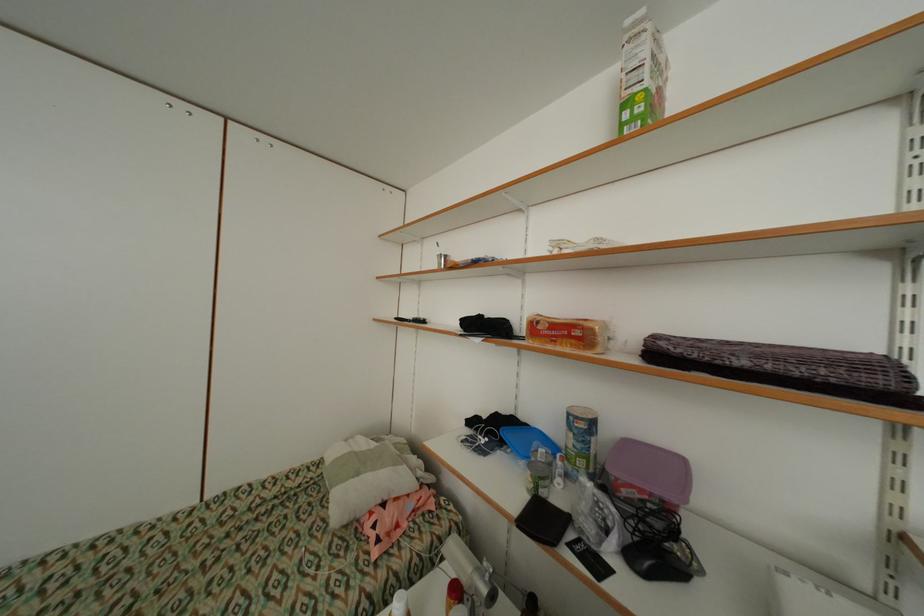
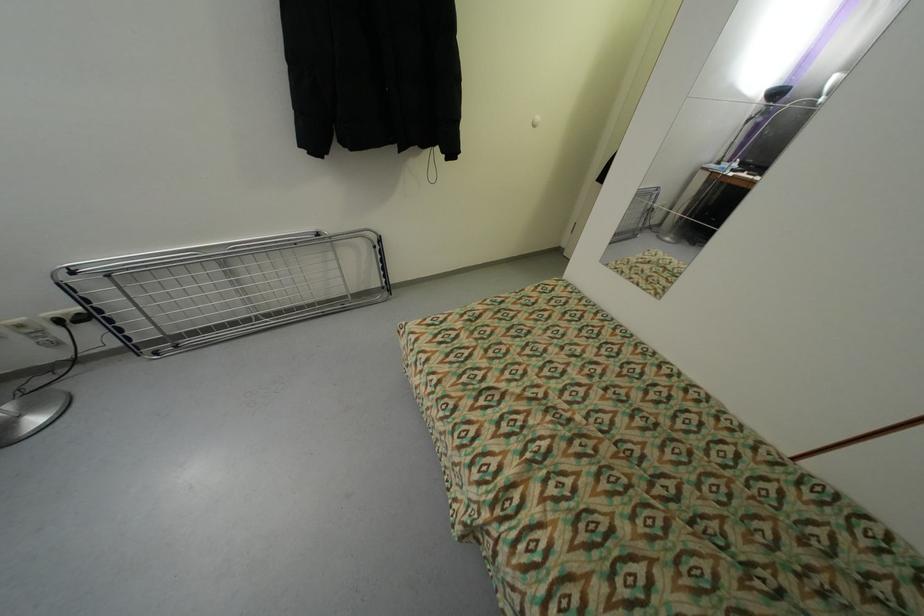
Based on the continuous images, in which direction is the camera rotating?

The rotation direction of the camera is left-down.